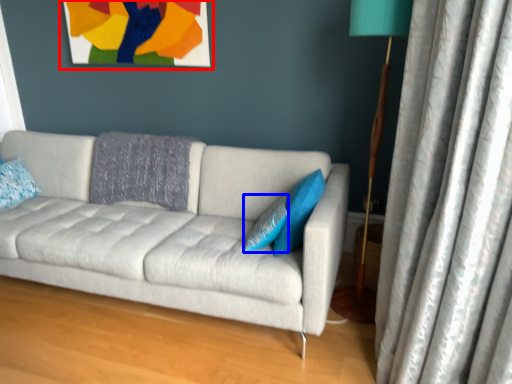
Question: Which object appears farthest to the camera in this image, picture frame (highlighted by a red box) or pillow (highlighted by a blue box)?

Choices:
 (A) picture frame
 (B) pillow

Answer: (A)